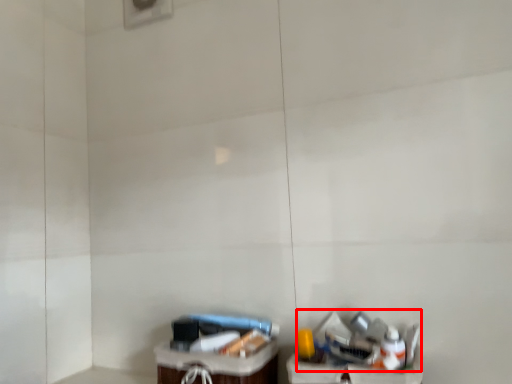
Question: From the image's perspective, what is the correct spatial relationship of garbage (annotated by the red box) in relation to furniture?

Choices:
 (A) below
 (B) above

Answer: (B)